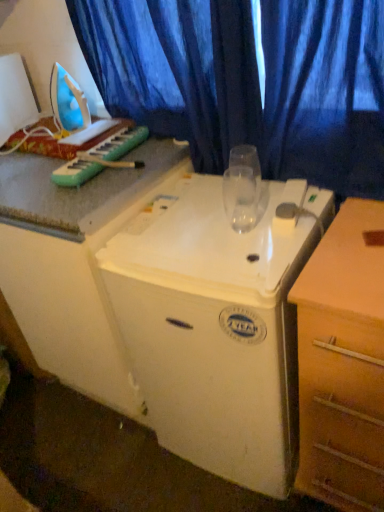
Locate an element on the screen. The width and height of the screenshot is (384, 512). free spot above white plastic refrigerator at center, the second appliance in the left-to-right sequence (from a real-world perspective) is located at coordinates (211, 217).